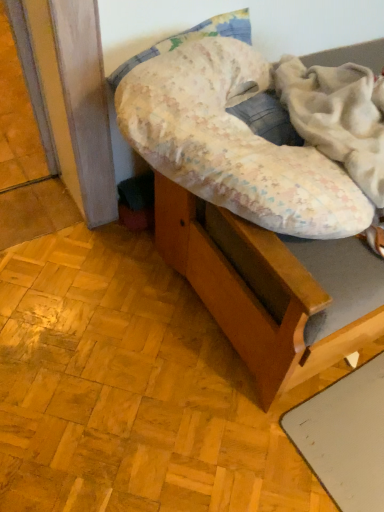
Question: In the image, is fluffy white blanket at upper right positioned in front of or behind wooden bed frame at center?

Choices:
 (A) behind
 (B) front

Answer: (B)

Question: Choose the correct answer: Is fluffy white blanket at upper right inside wooden bed frame at center or outside it?

Choices:
 (A) outside
 (B) inside

Answer: (B)

Question: From a real-world perspective, is fluffy white blanket at upper right physically located above or below wooden bed frame at center?

Choices:
 (A) below
 (B) above

Answer: (B)

Question: Visually, is wooden bed frame at center positioned to the left or to the right of fluffy white blanket at upper right?

Choices:
 (A) left
 (B) right

Answer: (B)

Question: Considering their positions, is wooden bed frame at center located in front of or behind fluffy white blanket at upper right?

Choices:
 (A) behind
 (B) front

Answer: (A)

Question: In terms of width, does wooden bed frame at center look wider or thinner when compared to fluffy white blanket at upper right?

Choices:
 (A) thin
 (B) wide

Answer: (B)

Question: Looking at the image, does wooden bed frame at center seem bigger or smaller compared to fluffy white blanket at upper right?

Choices:
 (A) big
 (B) small

Answer: (A)